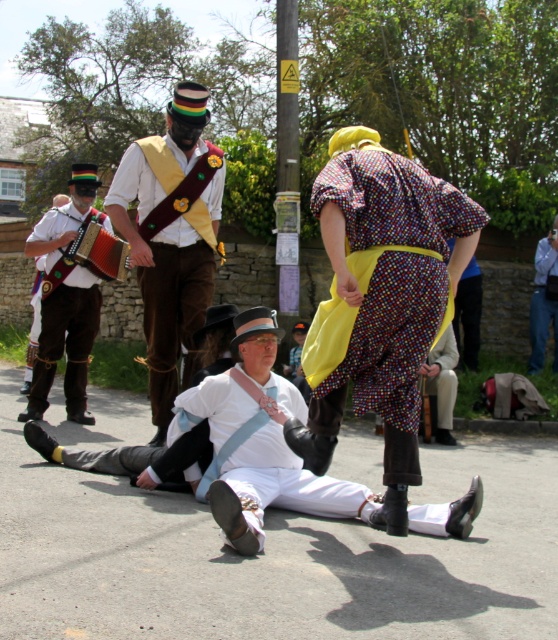
Does white matte pants at center have a larger size compared to blue jeans at lower right?

Yes.

Is point (353, 513) positioned after point (546, 289)?

No, (353, 513) is in front of (546, 289).

Locate an element on the screen. The image size is (558, 640). white matte pants at center is located at coordinates (286, 483).

Can you confirm if polka dot fabric dress at upper right is thinner than leather brown pants at left?

No, polka dot fabric dress at upper right is not thinner than leather brown pants at left.

Who is positioned more to the left, polka dot fabric dress at upper right or leather brown pants at left?

From the viewer's perspective, leather brown pants at left appears more on the left side.

Is point (334, 392) closer to viewer compared to point (84, 291)?

Yes.

Identify the location of polka dot fabric dress at upper right. The image size is (558, 640). (389, 282).

Does polka dot fabric dress at upper right have a smaller size compared to velvet brown vest at center?

Yes.

The height and width of the screenshot is (640, 558). What do you see at coordinates (389, 282) in the screenshot? I see `polka dot fabric dress at upper right` at bounding box center [389, 282].

Locate an element on the screen. polka dot fabric dress at upper right is located at coordinates (389, 282).

Identify the location of polka dot fabric dress at upper right. The image size is (558, 640). (389, 282).